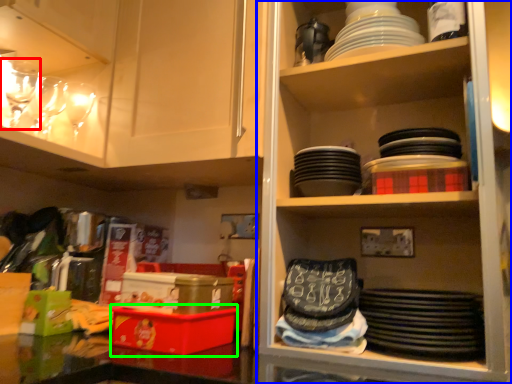
Question: Estimate the real-world distances between objects in this image. Which object is farther from tableware (highlighted by a red box), shelf (highlighted by a blue box) or box (highlighted by a green box)?

Choices:
 (A) shelf
 (B) box

Answer: (A)